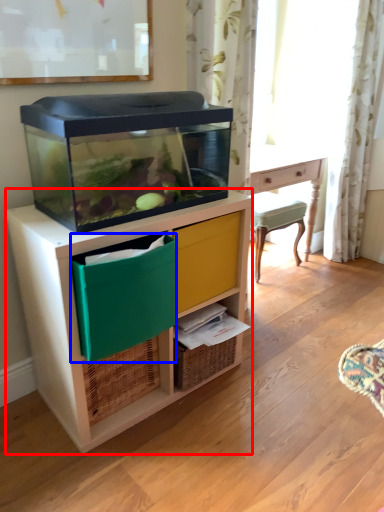
Question: Which object appears closest to the camera in this image, chest of drawers (highlighted by a red box) or storage box (highlighted by a blue box)?

Choices:
 (A) chest of drawers
 (B) storage box

Answer: (B)